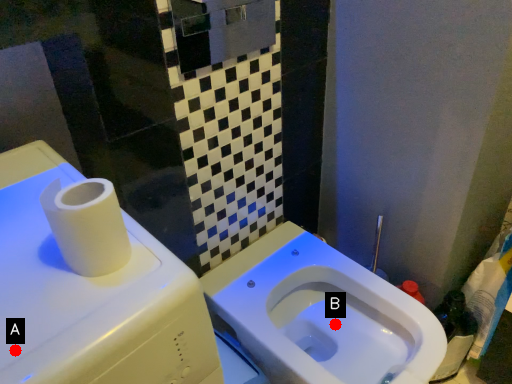
Question: Two points are circled on the image, labeled by A and B beside each circle. Which point is further to the camera?

Choices:
 (A) A is further
 (B) B is further

Answer: (B)